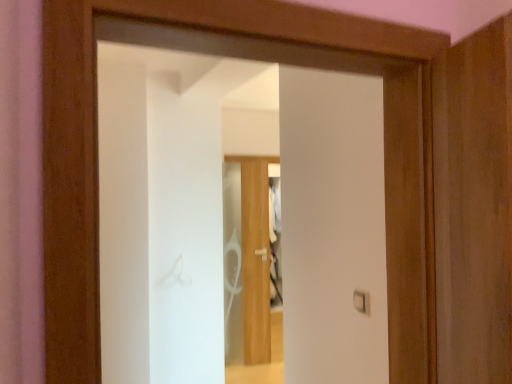
Find the location of `white plastic light switch at center`. white plastic light switch at center is located at coordinates (359, 301).

What do you see at coordinates (359, 301) in the screenshot? I see `white plastic light switch at center` at bounding box center [359, 301].

This screenshot has height=384, width=512. In order to click on transparent glass door at center in this screenshot , I will do click(x=384, y=167).

In order to face transparent glass door at center, should I rotate leftwards or rightwards?

Turn right approximately 4.101 degrees to face it.

The height and width of the screenshot is (384, 512). What do you see at coordinates (384, 167) in the screenshot?
I see `transparent glass door at center` at bounding box center [384, 167].

This screenshot has width=512, height=384. I want to click on white plastic light switch at center, so click(x=359, y=301).

Which is more to the left, white plastic light switch at center or transparent glass door at center?

From the viewer's perspective, transparent glass door at center appears more on the left side.

Who is more distant, white plastic light switch at center or transparent glass door at center?

white plastic light switch at center is further away from the camera.

Does point (365, 295) appear closer or farther from the camera than point (431, 199)?

Point (365, 295) appears to be farther away from the viewer than point (431, 199).

From the image's perspective, which one is positioned higher, white plastic light switch at center or transparent glass door at center?

transparent glass door at center is shown above in the image.

From a real-world perspective, is white plastic light switch at center physically located above or below transparent glass door at center?

white plastic light switch at center is situated lower than transparent glass door at center in the real world.

Is white plastic light switch at center thinner than transparent glass door at center?

Yes, white plastic light switch at center is thinner than transparent glass door at center.

Between white plastic light switch at center and transparent glass door at center, which one has less height?

Standing shorter between the two is white plastic light switch at center.

Who is smaller, white plastic light switch at center or transparent glass door at center?

With smaller size is white plastic light switch at center.

Is transparent glass door at center surrounded by white plastic light switch at center?

No, transparent glass door at center is not inside white plastic light switch at center.

Is white plastic light switch at center with transparent glass door at center?

They are not placed beside each other.

Is white plastic light switch at center positioned with its back to transparent glass door at center?

No, white plastic light switch at center's orientation is not away from transparent glass door at center.

Can you tell me how much white plastic light switch at center and transparent glass door at center differ in facing direction?

They differ by 89.4 degrees in their facing directions.

Find the location of a particular element. door on the left of white plastic light switch at center is located at coordinates (384, 167).

Considering the relative positions of transparent glass door at center and white plastic light switch at center in the image provided, is transparent glass door at center to the left or to the right of white plastic light switch at center?

transparent glass door at center is to the left of white plastic light switch at center.

Is the depth of transparent glass door at center less than that of white plastic light switch at center?

Yes.

Does point (197, 47) come behind point (355, 292)?

That is False.

From the image's perspective, does transparent glass door at center appear higher than white plastic light switch at center?

Yes, from the image's perspective, transparent glass door at center is over white plastic light switch at center.

From a real-world perspective, is transparent glass door at center on top of white plastic light switch at center?

Yes, from a real-world perspective, transparent glass door at center is over white plastic light switch at center

Based on the photo, can you confirm if transparent glass door at center is wider than white plastic light switch at center?

Yes.

In the scene shown: Does transparent glass door at center have a lesser height compared to white plastic light switch at center?

In fact, transparent glass door at center may be taller than white plastic light switch at center.

In terms of size, does transparent glass door at center appear bigger or smaller than white plastic light switch at center?

transparent glass door at center is bigger than white plastic light switch at center.

Is transparent glass door at center inside the boundaries of white plastic light switch at center, or outside?

transparent glass door at center exists outside the volume of white plastic light switch at center.

Is transparent glass door at center next to white plastic light switch at center and touching it?

There is a gap between transparent glass door at center and white plastic light switch at center.

Could you tell me if transparent glass door at center is turned towards white plastic light switch at center?

No, transparent glass door at center is not facing towards white plastic light switch at center.

Find the location of a particular element. door that is in front of the white plastic light switch at center is located at coordinates [384, 167].

The height and width of the screenshot is (384, 512). I want to click on door above the white plastic light switch at center (from a real-world perspective), so click(x=384, y=167).

What are the coordinates of `light switch behind the transparent glass door at center` in the screenshot? It's located at (359, 301).